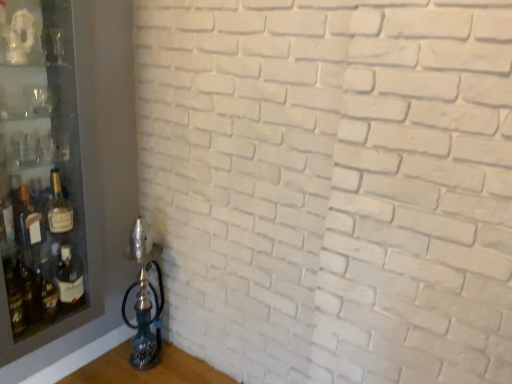
Question: Is transparent glass shelf at left inside or outside of matte glass bottle at left?

Choices:
 (A) inside
 (B) outside

Answer: (B)

Question: Looking at the image, does transparent glass shelf at left seem bigger or smaller compared to matte glass bottle at left?

Choices:
 (A) big
 (B) small

Answer: (A)

Question: Visually, is transparent glass shelf at left positioned to the left or to the right of matte glass bottle at left?

Choices:
 (A) left
 (B) right

Answer: (A)

Question: Considering the positions of matte glass bottle at left and transparent glass shelf at left in the image, is matte glass bottle at left wider or thinner than transparent glass shelf at left?

Choices:
 (A) wide
 (B) thin

Answer: (B)

Question: Which is correct: matte glass bottle at left is inside transparent glass shelf at left, or outside of it?

Choices:
 (A) inside
 (B) outside

Answer: (A)

Question: From a real-world perspective, is matte glass bottle at left positioned above or below transparent glass shelf at left?

Choices:
 (A) above
 (B) below

Answer: (B)

Question: Relative to transparent glass shelf at left, is matte glass bottle at left in front or behind?

Choices:
 (A) front
 (B) behind

Answer: (B)